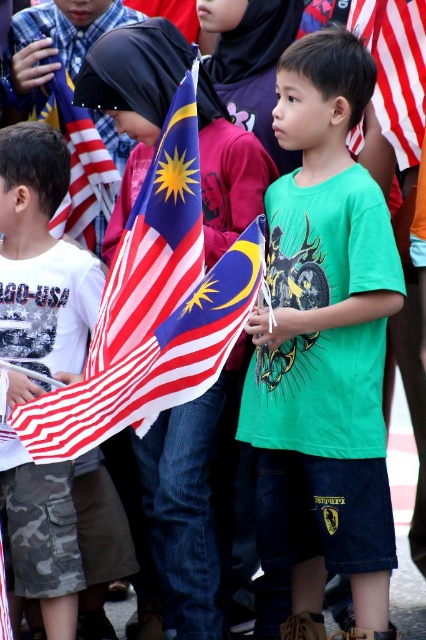
Question: Does green matte shirt at center have a larger size compared to red-white striped flag at upper right?

Choices:
 (A) no
 (B) yes

Answer: (B)

Question: Considering the real-world distances, which object is farthest from the red-white striped fabric flag at center?

Choices:
 (A) white camouflage pants at left
 (B) red-white striped flag at upper left
 (C) green matte shirt at center
 (D) red-white striped flag at upper right

Answer: (D)

Question: Which is farther from the white camouflage pants at left?

Choices:
 (A) green matte shirt at center
 (B) red-white striped flag at upper left
 (C) red-white striped flag at upper right
 (D) red-white striped fabric flag at center

Answer: (C)

Question: Can you confirm if white camouflage pants at left is positioned to the left of red-white striped flag at upper right?

Choices:
 (A) yes
 (B) no

Answer: (A)

Question: Which object is positioned farthest from the red-white striped flag at upper left?

Choices:
 (A) red-white striped flag at upper right
 (B) green matte shirt at center

Answer: (A)

Question: Can you confirm if white camouflage pants at left is positioned above red-white striped flag at upper right?

Choices:
 (A) yes
 (B) no

Answer: (B)